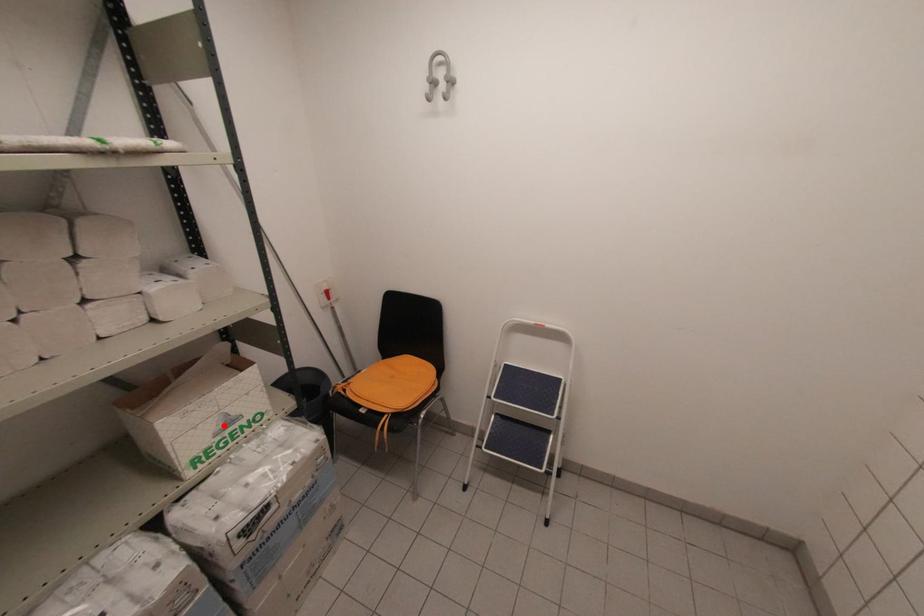
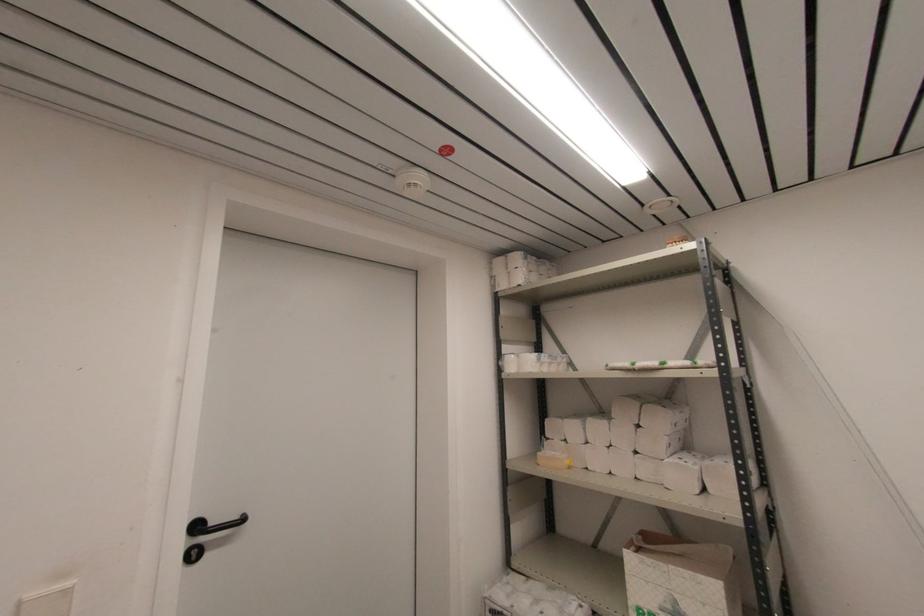
Question: I am providing you with two images of the same scene from different viewpoints. In image1, a red point is highlighted. Considering the same 3D point in image2, which of the following is correct?

Choices:
 (A) It is closer
 (B) It is farther

Answer: (A)